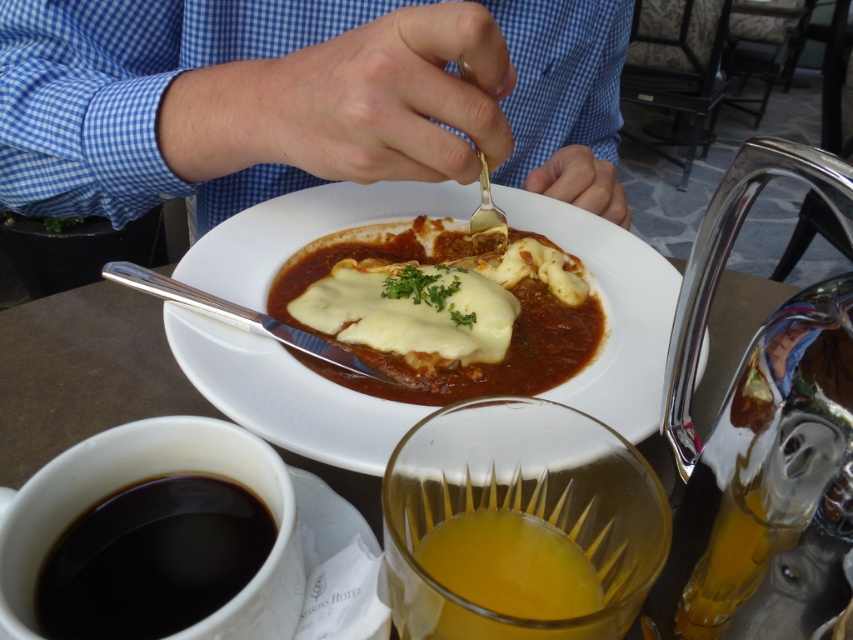
Question: Can you confirm if white glossy plate at center is wider than translucent yellow liquid at lower center?

Choices:
 (A) yes
 (B) no

Answer: (A)

Question: Is translucent glass orange juice at lower center thinner than black matte cup at lower left?

Choices:
 (A) yes
 (B) no

Answer: (B)

Question: Estimate the real-world distances between objects in this image. Which object is farther from the translucent yellow liquid at lower center?

Choices:
 (A) blue checkered shirt at upper center
 (B) white creamy lasagna at center
 (C) black matte cup at lower left

Answer: (A)

Question: Which of the following is the farthest from the observer?

Choices:
 (A) black matte cup at lower left
 (B) white glossy plate at center

Answer: (B)

Question: Does white glossy plate at center come in front of black matte cup at lower left?

Choices:
 (A) yes
 (B) no

Answer: (B)

Question: Which object is farther from the camera taking this photo?

Choices:
 (A) translucent glass orange juice at lower center
 (B) white glossy plate at center
 (C) white creamy lasagna at center

Answer: (C)